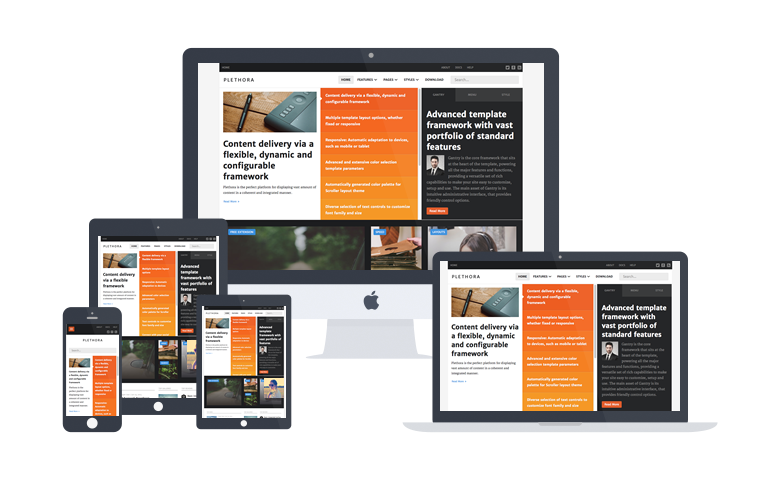
The height and width of the screenshot is (480, 780). I want to click on stand, so click(360, 339).